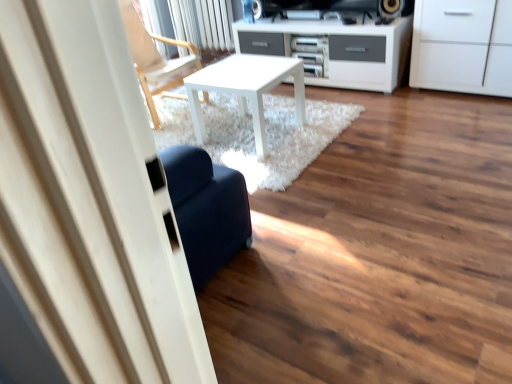
The height and width of the screenshot is (384, 512). Identify the location of free space on the front side of white matte table at center. (277, 159).